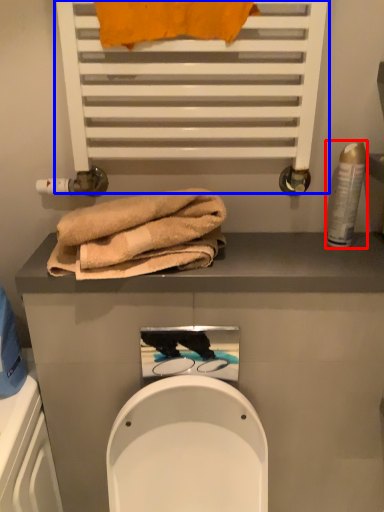
Question: Which object appears closest to the camera in this image, toiletry (highlighted by a red box) or shelf (highlighted by a blue box)?

Choices:
 (A) toiletry
 (B) shelf

Answer: (B)